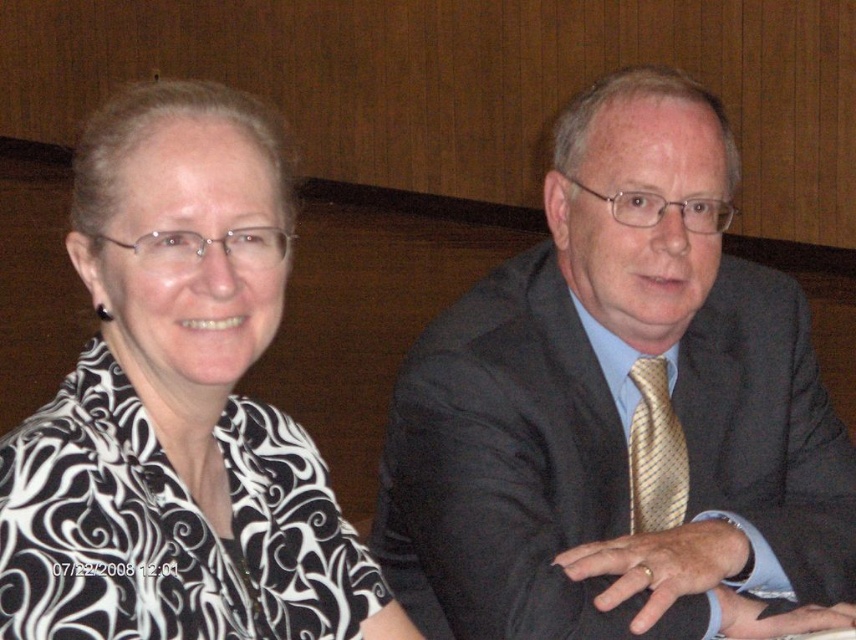
Question: Is dark gray suit at center further to camera compared to gold striped tie at center?

Choices:
 (A) yes
 (B) no

Answer: (B)

Question: Which is nearer to the dark gray suit at center?

Choices:
 (A) black printed blouse at left
 (B) gold striped tie at center

Answer: (B)

Question: Is dark gray suit at center to the right of gold striped tie at center from the viewer's perspective?

Choices:
 (A) no
 (B) yes

Answer: (A)

Question: Is dark gray suit at center thinner than gold striped tie at center?

Choices:
 (A) yes
 (B) no

Answer: (B)

Question: Which of the following is the closest to the observer?

Choices:
 (A) (664, 401)
 (B) (651, 604)
 (C) (211, 419)

Answer: (C)

Question: Which point is closer to the camera taking this photo?

Choices:
 (A) (411, 627)
 (B) (682, 496)
 (C) (764, 442)

Answer: (A)